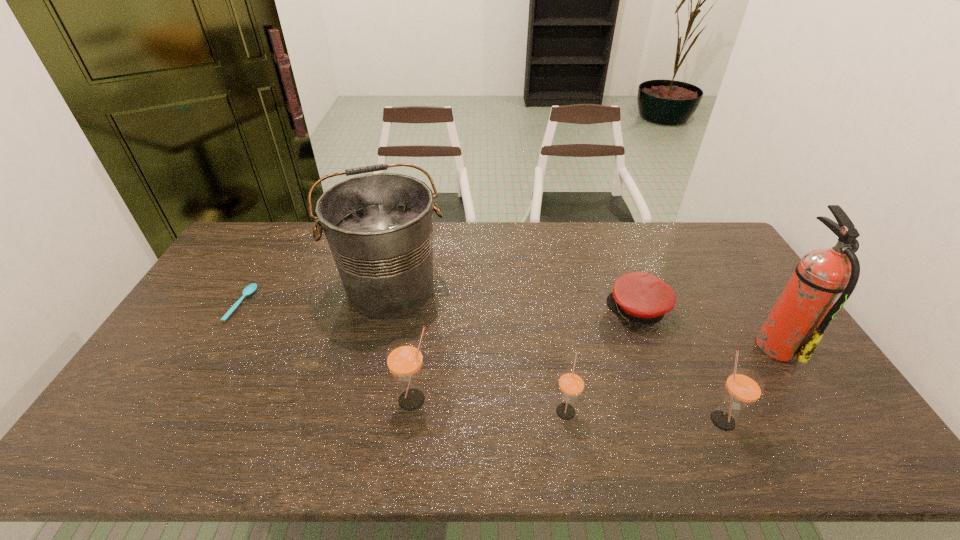
Please point a vacant point for placing a straw on the left. Please provide its 2D coordinates. Your answer should be formatted as a tuple, i.e. [(x, y)], where the tuple contains the x and y coordinates of a point satisfying the conditions above.

[(269, 390)]